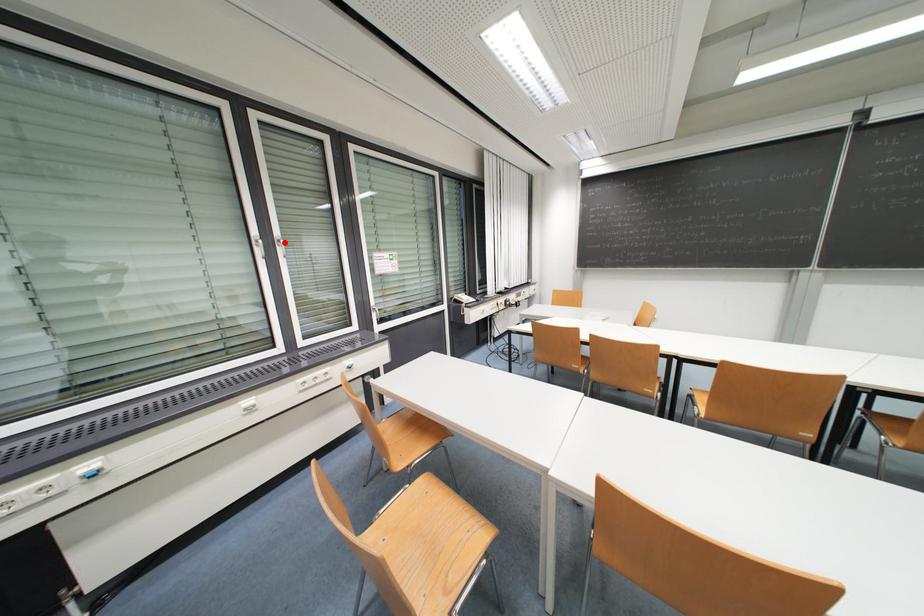
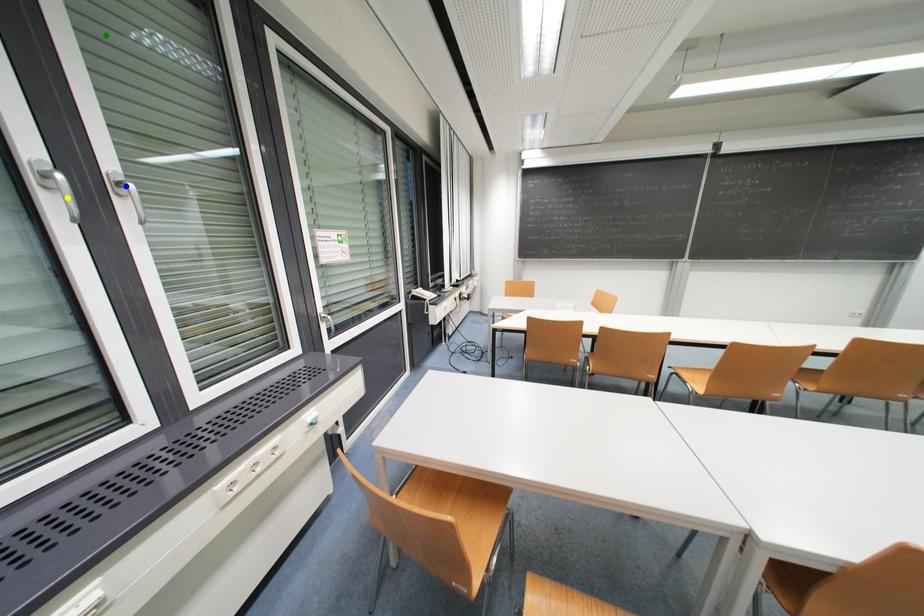
Question: I am providing you with two images of the same scene from different viewpoints. A red point is marked on the first image. You are given multiple points on the second image. Which point in image 2 represents the same 3d spot as the red point in image 1?

Choices:
 (A) blue point
 (B) yellow point
 (C) green point

Answer: (A)